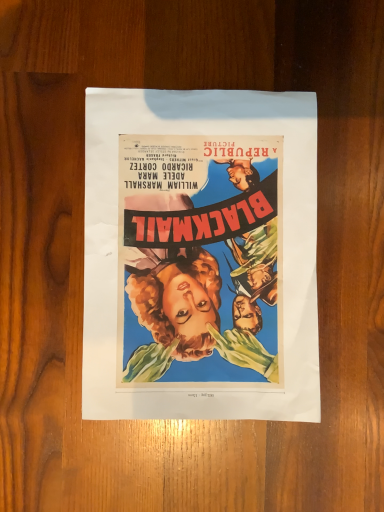
You are a GUI agent. You are given a task and a screenshot of the screen. Output one action in this format:
    pyautogui.click(x=<x>, y=<y>)
    Task: Click on the free space above vibrant paper poster at center (from a real-world perspective)
    
    Given the screenshot: What is the action you would take?
    (196, 256)